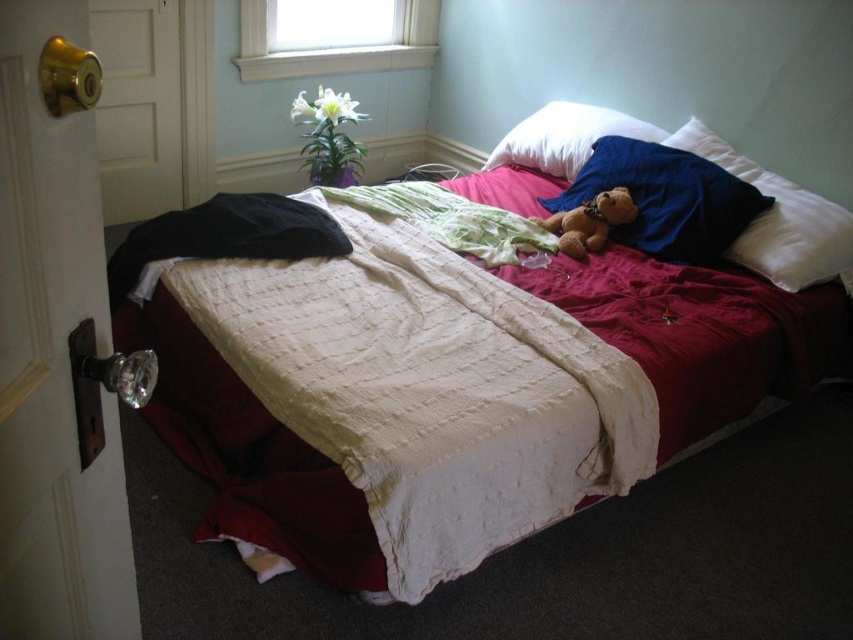
Question: Does soft blue pillow at upper right come behind white soft pillow at upper center?

Choices:
 (A) no
 (B) yes

Answer: (A)

Question: Is white quilted bed at center above white soft pillow at upper right?

Choices:
 (A) no
 (B) yes

Answer: (A)

Question: Which object appears farthest from the camera in this image?

Choices:
 (A) soft blue pillow at upper right
 (B) brown plush teddy bear at center
 (C) white soft pillow at upper center
 (D) white quilted bed at center

Answer: (C)

Question: Which object is positioned farthest from the white quilted bed at center?

Choices:
 (A) white soft pillow at upper center
 (B) white soft pillow at upper right

Answer: (A)

Question: Is white quilted bed at center below soft blue pillow at upper right?

Choices:
 (A) no
 (B) yes

Answer: (B)

Question: Which point is farther to the camera?

Choices:
 (A) white quilted bed at center
 (B) brown plush teddy bear at center

Answer: (B)